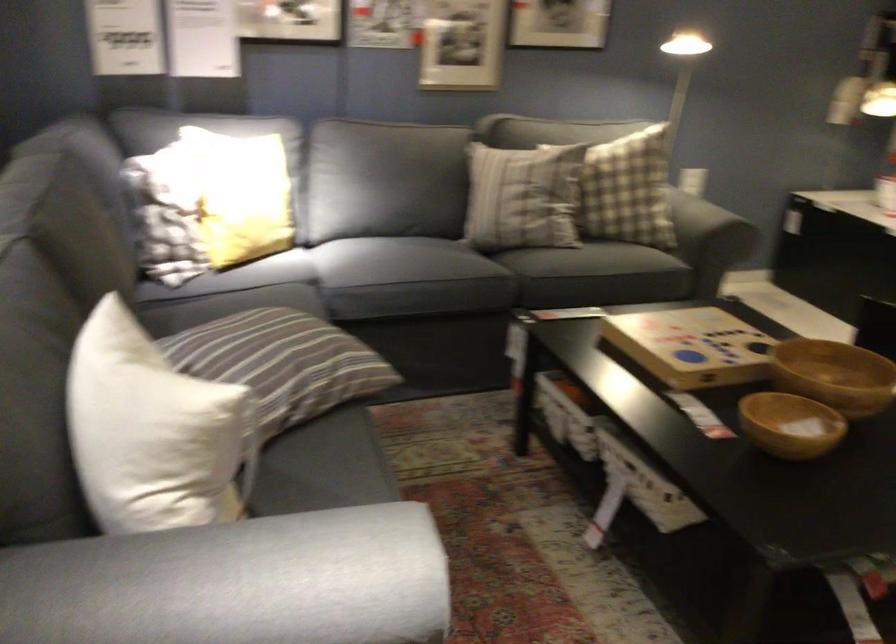
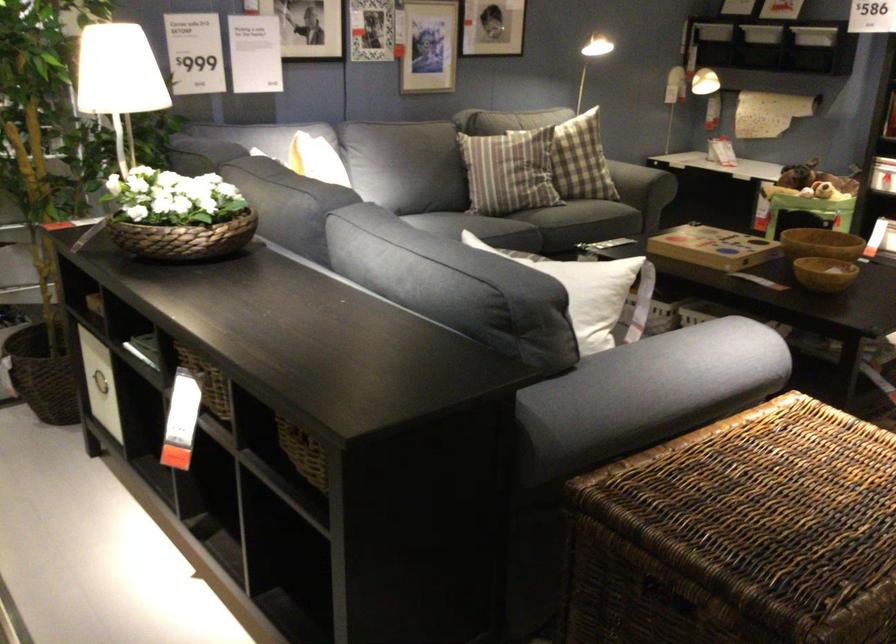
Where in the second image is the point corresponding to point (645, 216) from the first image?

(633, 180)